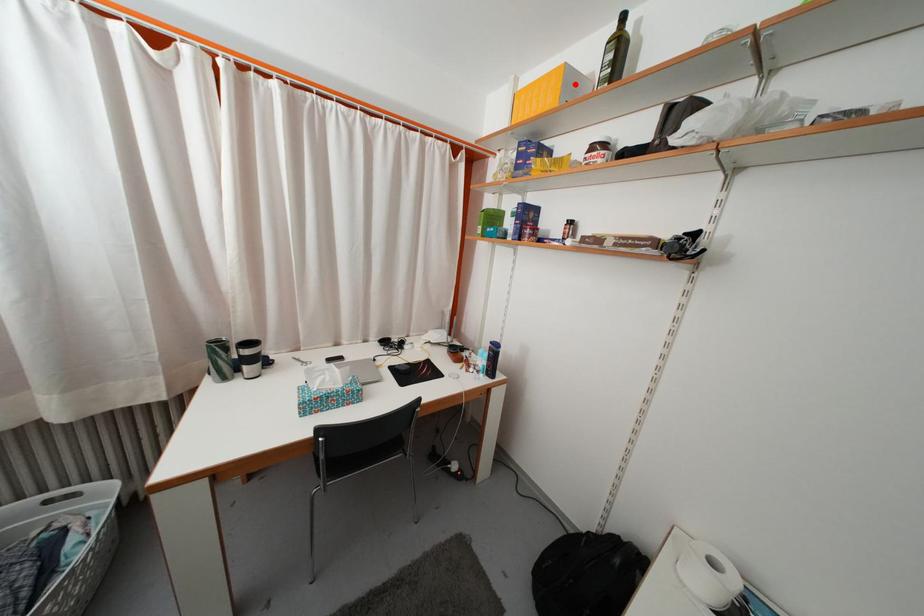
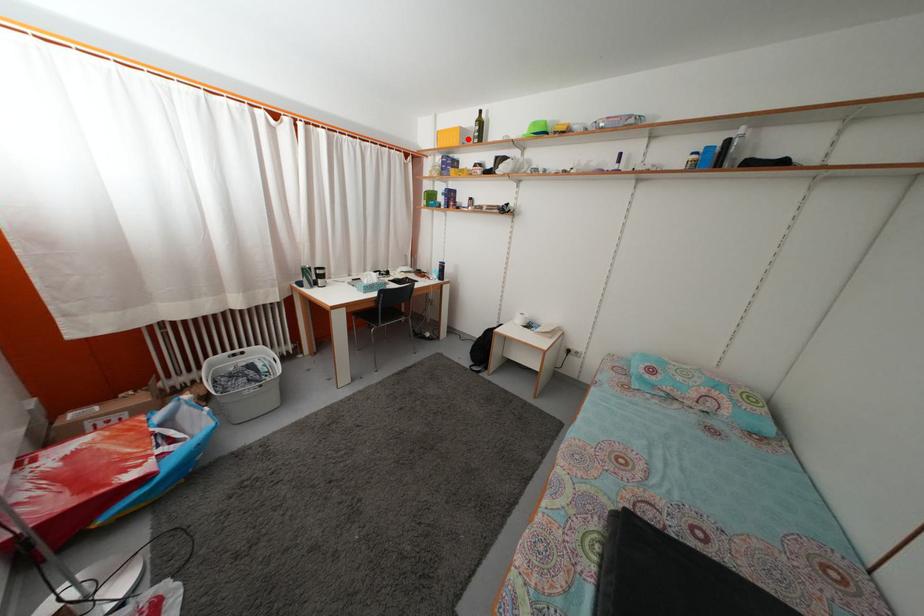
I am providing you with two images of the same scene from different viewpoints. A red point is marked on the first image and another point is marked on the second image. Do the highlighted points in image1 and image2 indicate the same real-world spot?

Yes